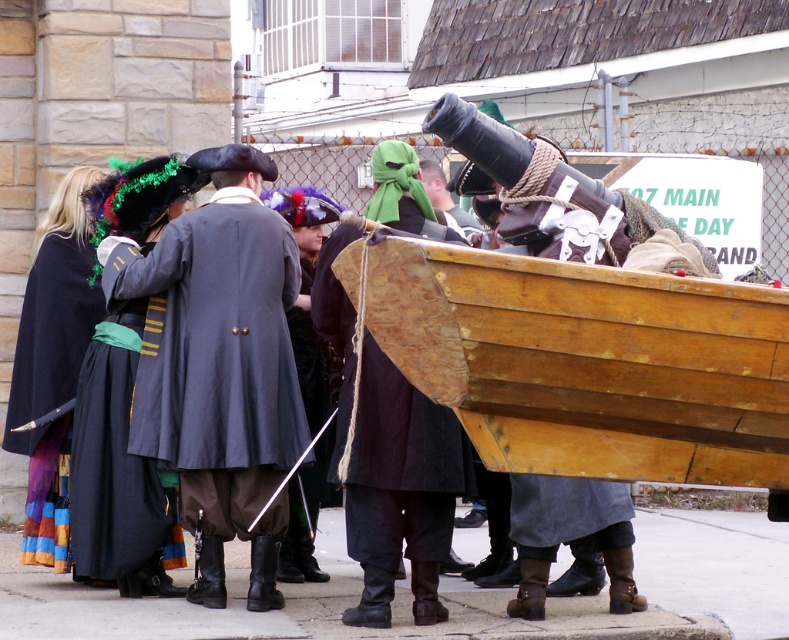
Can you confirm if wooden boat at center is shorter than matte black cape at left?

Correct, wooden boat at center is not as tall as matte black cape at left.

Between wooden boat at center and matte black cape at left, which one appears on the left side from the viewer's perspective?

Positioned to the left is matte black cape at left.

Find the location of a particular element. wooden boat at center is located at coordinates (589, 364).

Who is positioned more to the left, wooden boat at center or matte gray coat at center?

Positioned to the left is matte gray coat at center.

The height and width of the screenshot is (640, 789). Identify the location of wooden boat at center. (589, 364).

Between matte gray coat at center and matte black cape at left, which one has less height?

matte black cape at left

Is matte gray coat at center shorter than matte black cape at left?

No.

Identify the location of matte gray coat at center. (219, 364).